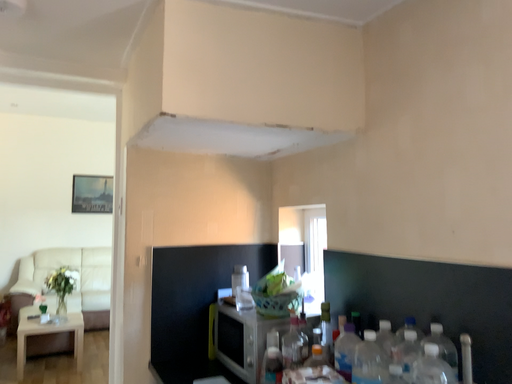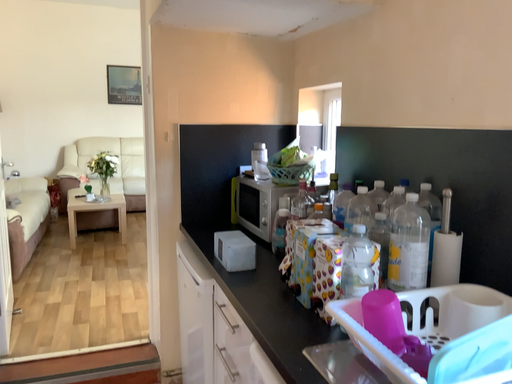
Question: Which way did the camera rotate in the video?

Choices:
 (A) rotated downward
 (B) rotated upward

Answer: (A)